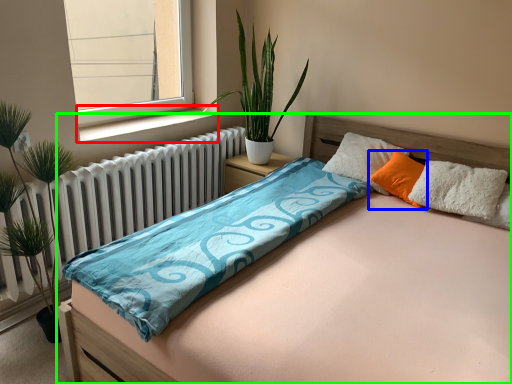
Question: Considering the real-world distances, which object is farthest from window sill (highlighted by a red box)? pillow (highlighted by a blue box) or bed (highlighted by a green box)?

Choices:
 (A) pillow
 (B) bed

Answer: (B)